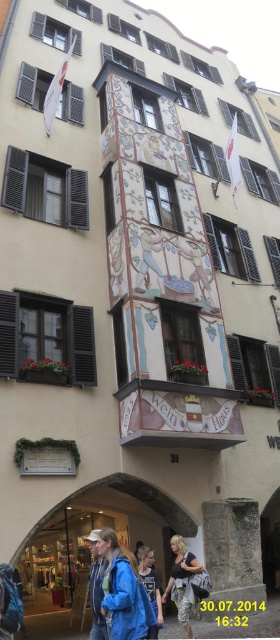
Which of these two, blue denim jacket at lower left or blue denim jacket at lower center, stands taller?

With more height is blue denim jacket at lower left.

Between blue denim jacket at lower left and blue denim jacket at lower center, which one is positioned lower?

Positioned lower is blue denim jacket at lower left.

Is point (99, 554) positioned in front of point (148, 589)?

Yes, point (99, 554) is closer to viewer.

At what (x,y) coordinates should I click in order to perform the action: click on blue denim jacket at lower left. Please return your answer as a coordinate pair (x, y). The image size is (280, 640). Looking at the image, I should click on (96, 588).

Can you confirm if camouflage-patterned shorts at center is wider than blue denim jacket at lower left?

Incorrect, camouflage-patterned shorts at center's width does not surpass blue denim jacket at lower left's.

Based on the photo, who is taller, camouflage-patterned shorts at center or blue denim jacket at lower left?

With more height is blue denim jacket at lower left.

Is point (173, 595) farther from viewer compared to point (94, 552)?

Yes, point (173, 595) is farther from viewer.

I want to click on camouflage-patterned shorts at center, so click(182, 580).

Does blue fleece jacket at lower left have a lesser height compared to camouflage-patterned shorts at center?

Incorrect, blue fleece jacket at lower left's height does not fall short of camouflage-patterned shorts at center's.

The image size is (280, 640). Describe the element at coordinates (122, 592) in the screenshot. I see `blue fleece jacket at lower left` at that location.

Where is `blue fleece jacket at lower left`? blue fleece jacket at lower left is located at coordinates (122, 592).